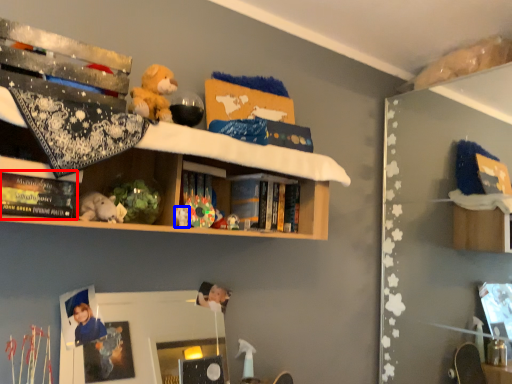
Question: Which of the following is the farthest to the observer, book (highlighted by a red box) or toy (highlighted by a blue box)?

Choices:
 (A) book
 (B) toy

Answer: (B)